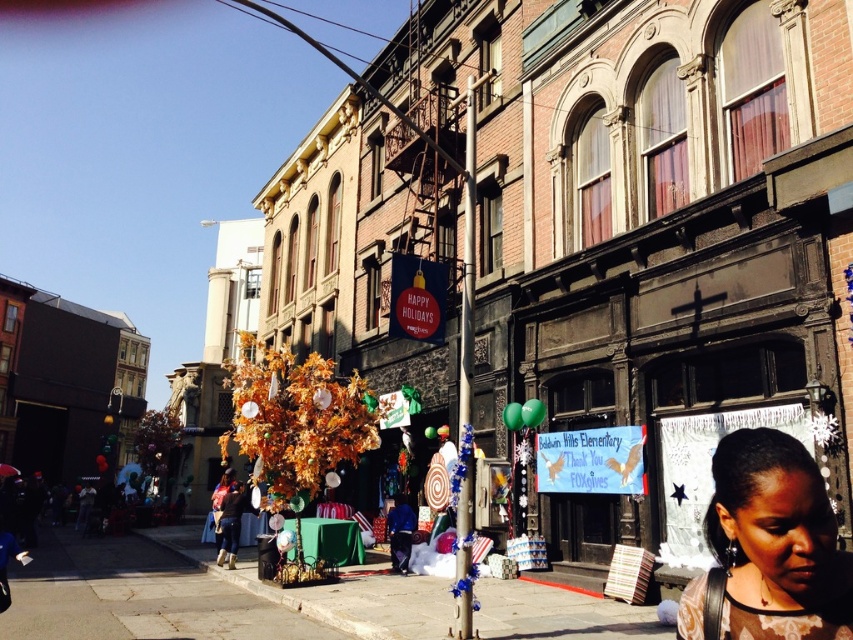
Who is taller, matte brown hair at lower right or matte black crowd at lower left?

matte black crowd at lower left is taller.

Based on the photo, who is more distant from viewer, (744, 637) or (19, 513)?

The point (19, 513) is more distant.

What do you see at coordinates (769, 547) in the screenshot? This screenshot has width=853, height=640. I see `matte brown hair at lower right` at bounding box center [769, 547].

You are a GUI agent. You are given a task and a screenshot of the screen. Output one action in this format:
    pyautogui.click(x=<x>, y=<y>)
    Task: Click on the matte brown hair at lower right
    Image resolution: width=853 pixels, height=640 pixels.
    Given the screenshot: What is the action you would take?
    pyautogui.click(x=769, y=547)